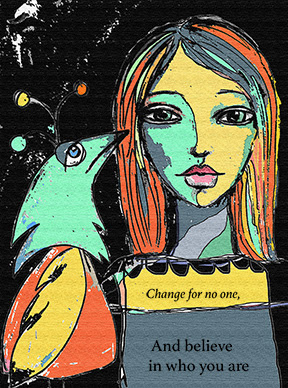
Identify the location of poster. (189, 294).